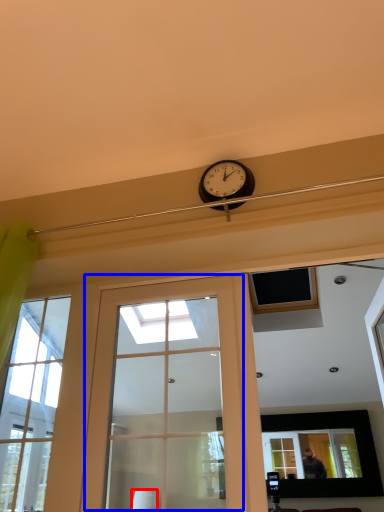
Question: Which object is further to the camera taking this photo, lamp (highlighted by a red box) or door (highlighted by a blue box)?

Choices:
 (A) lamp
 (B) door

Answer: (A)